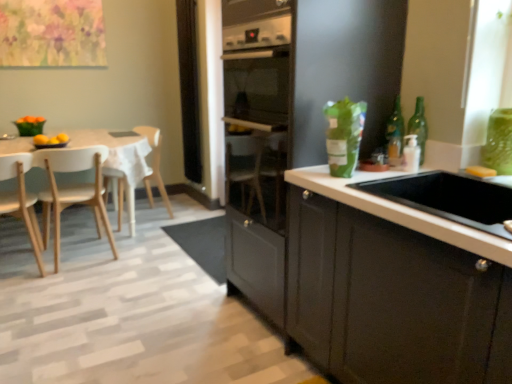
Question: Should I look upward or downward to see black mesh screen at center?

Choices:
 (A) up
 (B) down

Answer: (A)

Question: Considering the relative sizes of light wood chair at left, acting as the 2th chair starting from the back, and black mesh screen at center in the image provided, is light wood chair at left, acting as the 2th chair starting from the back, smaller than black mesh screen at center?

Choices:
 (A) yes
 (B) no

Answer: (B)

Question: Considering the relative sizes of light wood chair at left, the 2th chair viewed from the front, and black mesh screen at center in the image provided, is light wood chair at left, the 2th chair viewed from the front, taller than black mesh screen at center?

Choices:
 (A) no
 (B) yes

Answer: (A)

Question: Is light wood chair at left, acting as the 2th chair starting from the back, behind black mesh screen at center?

Choices:
 (A) yes
 (B) no

Answer: (B)

Question: Is light wood chair at left, the 2th chair viewed from the front, shorter than black mesh screen at center?

Choices:
 (A) no
 (B) yes

Answer: (B)

Question: Is light wood chair at left, the 2th chair viewed from the front, bigger than black mesh screen at center?

Choices:
 (A) yes
 (B) no

Answer: (A)

Question: Is light wood chair at left, the 2th chair viewed from the front, facing towards black mesh screen at center?

Choices:
 (A) no
 (B) yes

Answer: (A)

Question: From a real-world perspective, is light wood chair at left, the 2th chair viewed from the front, located beneath light wood chair at left, which is the third chair in back-to-front order?

Choices:
 (A) yes
 (B) no

Answer: (B)

Question: From a real-world perspective, is light wood chair at left, acting as the 2th chair starting from the back, physically above light wood chair at left, arranged as the 1th chair when viewed from the front?

Choices:
 (A) no
 (B) yes

Answer: (B)

Question: From the image's perspective, is light wood chair at left, the 2th chair viewed from the front, on light wood chair at left, which is the third chair in back-to-front order?

Choices:
 (A) yes
 (B) no

Answer: (A)

Question: From the image's perspective, would you say light wood chair at left, the 2th chair viewed from the front, is shown under light wood chair at left, arranged as the 1th chair when viewed from the front?

Choices:
 (A) no
 (B) yes

Answer: (A)

Question: Is light wood chair at left, the 2th chair viewed from the front, bigger than light wood chair at left, which is the third chair in back-to-front order?

Choices:
 (A) no
 (B) yes

Answer: (B)

Question: Considering the relative sizes of light wood chair at left, the 2th chair viewed from the front, and light wood chair at left, arranged as the 1th chair when viewed from the front, in the image provided, is light wood chair at left, the 2th chair viewed from the front, thinner than light wood chair at left, arranged as the 1th chair when viewed from the front,?

Choices:
 (A) no
 (B) yes

Answer: (A)

Question: Considering the relative sizes of white wood table at left and wooden chair at left, the 1th chair from the back, in the image provided, is white wood table at left smaller than wooden chair at left, the 1th chair from the back,?

Choices:
 (A) no
 (B) yes

Answer: (A)